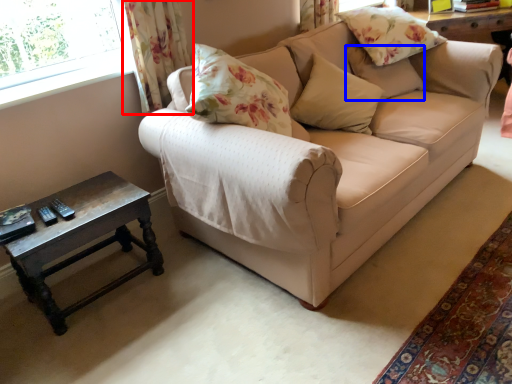
Question: Which of the following is the farthest to the observer, curtain (highlighted by a red box) or pillow (highlighted by a blue box)?

Choices:
 (A) curtain
 (B) pillow

Answer: (B)